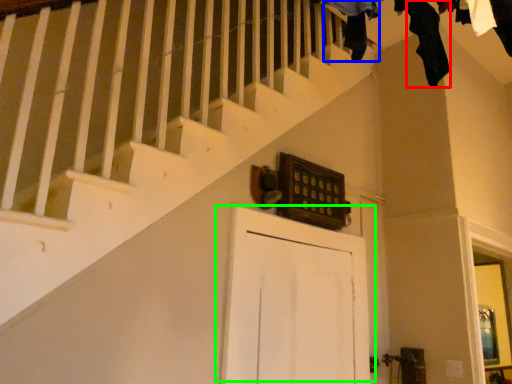
Question: Which is farther away from clothing (highlighted by a red box)? clothing (highlighted by a blue box) or door (highlighted by a green box)?

Choices:
 (A) clothing
 (B) door

Answer: (B)